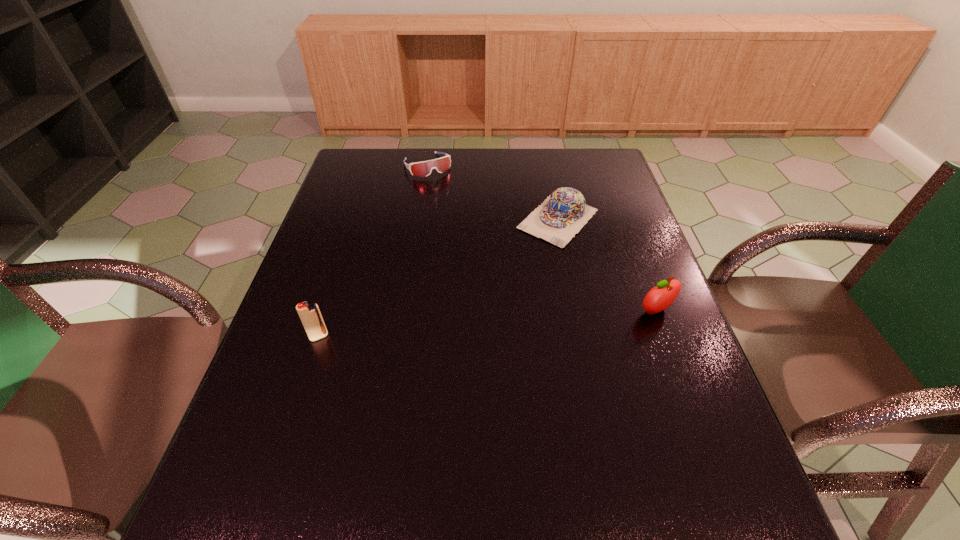
Locate an element on the screen. The width and height of the screenshot is (960, 540). free space between the rightmost object and the cap is located at coordinates (607, 265).

You are a GUI agent. You are given a task and a screenshot of the screen. Output one action in this format:
    pyautogui.click(x=<x>, y=<y>)
    Task: Click on the free space between the second object from right to left and the shortest object
    The height and width of the screenshot is (540, 960).
    Given the screenshot: What is the action you would take?
    pyautogui.click(x=492, y=192)

Where is `vacant point located between the third farthest object and the second object from right to left`? The width and height of the screenshot is (960, 540). vacant point located between the third farthest object and the second object from right to left is located at coordinates click(607, 265).

This screenshot has height=540, width=960. Identify the location of vacant area between the second object from right to left and the second nearest object. (607, 265).

At what (x,y) coordinates should I click in order to perform the action: click on empty location between the cap and the nearest object. Please return your answer as a coordinate pair (x, y). This screenshot has height=540, width=960. Looking at the image, I should click on (439, 278).

The width and height of the screenshot is (960, 540). Find the location of `the third closest object to the third object from right to left`. the third closest object to the third object from right to left is located at coordinates (660, 297).

Point out which object is positioned as the third nearest to the second object from right to left. Please provide its 2D coordinates. Your answer should be formatted as a tuple, i.e. [(x, y)], where the tuple contains the x and y coordinates of a point satisfying the conditions above.

[(310, 315)]

At what (x,y) coordinates should I click in order to perform the action: click on free point that satisfies the following two spatial constraints: 1. on the front side of the shortest object; 2. on the right side of the apple. Please return your answer as a coordinate pair (x, y). This screenshot has height=540, width=960. Looking at the image, I should click on [404, 311].

This screenshot has width=960, height=540. What are the coordinates of `free space that satisfies the following two spatial constraints: 1. on the front side of the third object from left to right; 2. on the right side of the second object from left to right` in the screenshot? It's located at (420, 219).